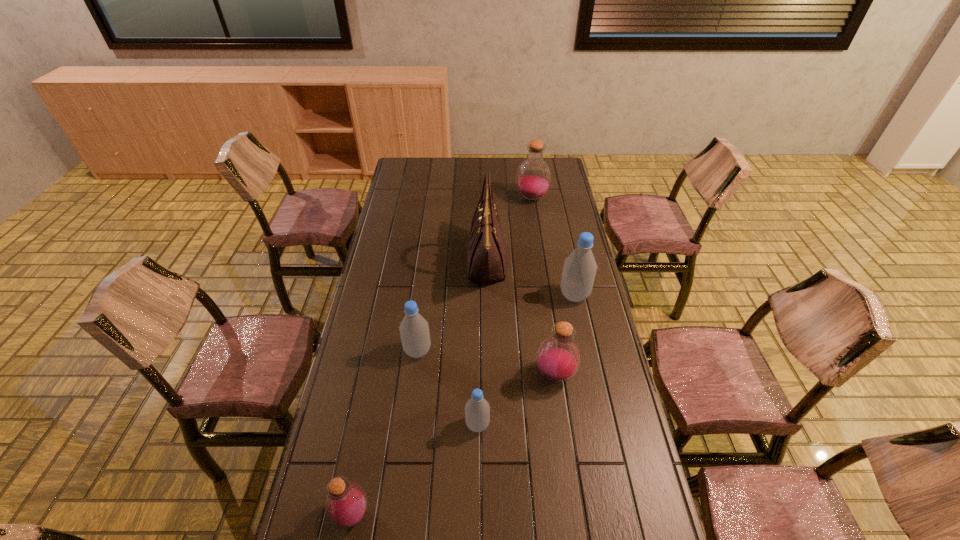
This screenshot has height=540, width=960. Identify the location of the tallest object. (487, 259).

Find the location of a particular element. The height and width of the screenshot is (540, 960). the farthest gray bottle is located at coordinates [x=579, y=270].

This screenshot has width=960, height=540. I want to click on the rightmost gray bottle, so click(x=579, y=270).

Where is `the farthest object`? the farthest object is located at coordinates (533, 177).

At what (x,y) coordinates should I click in order to perform the action: click on the farthest purple bottle. Please return your answer as a coordinate pair (x, y). Looking at the image, I should click on (533, 177).

At what (x,y) coordinates should I click in order to perform the action: click on the second nearest purple bottle. Please return your answer as a coordinate pair (x, y). Image resolution: width=960 pixels, height=540 pixels. Looking at the image, I should click on (558, 358).

Where is `the second object from left to right`? The width and height of the screenshot is (960, 540). the second object from left to right is located at coordinates (414, 330).

Image resolution: width=960 pixels, height=540 pixels. I want to click on the second nearest gray bottle, so click(x=414, y=330).

At what (x,y) coordinates should I click in order to perform the action: click on the fifth farthest bottle. Please return your answer as a coordinate pair (x, y). This screenshot has width=960, height=540. Looking at the image, I should click on (477, 410).

Identify the location of the nearest gray bottle. (477, 410).